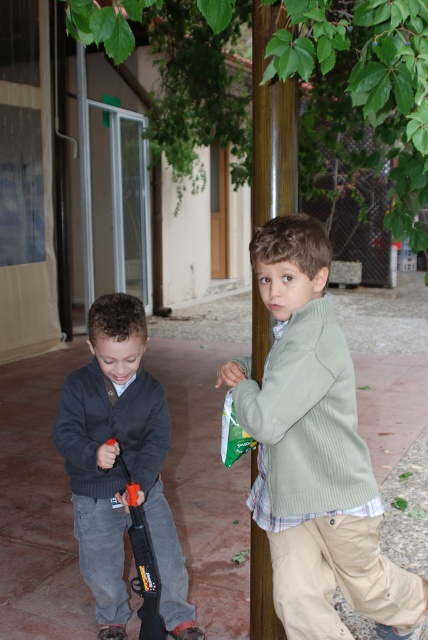
Question: Considering the relative positions of dark gray sweater at left and orange plastic gun at left in the image provided, where is dark gray sweater at left located with respect to orange plastic gun at left?

Choices:
 (A) below
 (B) above

Answer: (B)

Question: Which point is closer to the camera taking this photo?

Choices:
 (A) (94, 579)
 (B) (163, 621)

Answer: (B)

Question: Among these points, which one is nearest to the camera?

Choices:
 (A) (270, 394)
 (B) (255, 296)
 (C) (136, 538)
 (D) (92, 353)

Answer: (A)

Question: Which object is the closest to the dark gray sweater at left?

Choices:
 (A) orange plastic gun at left
 (B) brown wooden pole at center

Answer: (A)

Question: Is light green sweater at center to the left of dark gray sweater at left from the viewer's perspective?

Choices:
 (A) yes
 (B) no

Answer: (B)

Question: Can you confirm if light green sweater at center is bigger than brown wooden pole at center?

Choices:
 (A) no
 (B) yes

Answer: (B)